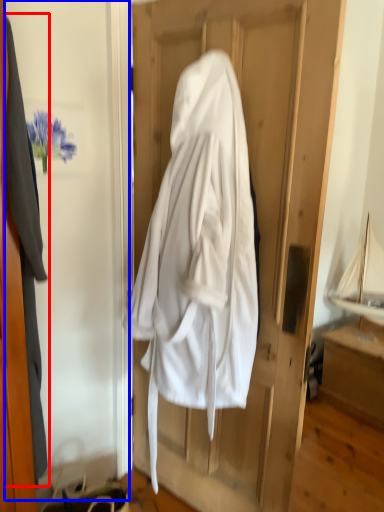
Question: Which object appears closest to the camera in this image, garment (highlighted by a red box) or screen door (highlighted by a blue box)?

Choices:
 (A) garment
 (B) screen door

Answer: (B)